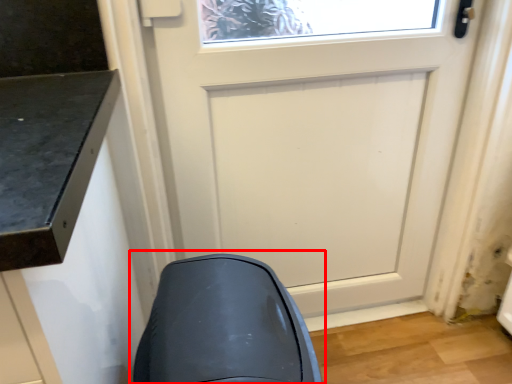
Question: From the image's perspective, what is the correct spatial relationship of swivel chair (annotated by the red box) in relation to door?

Choices:
 (A) above
 (B) below

Answer: (B)